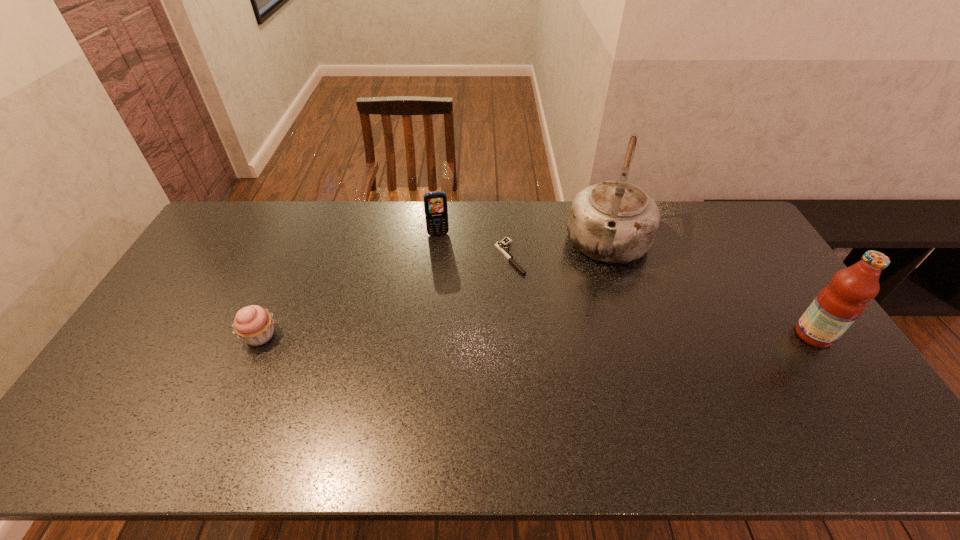
You are a GUI agent. You are given a task and a screenshot of the screen. Output one action in this format:
    pyautogui.click(x=<x>, y=<y>)
    Task: Click on the vacant space on the desktop that is between the second shortest object and the rightmost object and is positioned at the spout of the fourth object from left to right
    The image size is (960, 540).
    Given the screenshot: What is the action you would take?
    pyautogui.click(x=587, y=335)

You are a GUI agent. You are given a task and a screenshot of the screen. Output one action in this format:
    pyautogui.click(x=<x>, y=<y>)
    Task: Click on the free space on the desktop that is between the leftmost object and the rightmost object and is positioned on the front-facing side of the shortest object
    
    Given the screenshot: What is the action you would take?
    pyautogui.click(x=588, y=335)

You are a GUI agent. You are given a task and a screenshot of the screen. Output one action in this format:
    pyautogui.click(x=<x>, y=<y>)
    Task: Click on the free space on the desktop that is between the cupcake and the rightmost object and is positioned on the screen of the cellular telephone
    This screenshot has height=540, width=960.
    Given the screenshot: What is the action you would take?
    pyautogui.click(x=455, y=335)